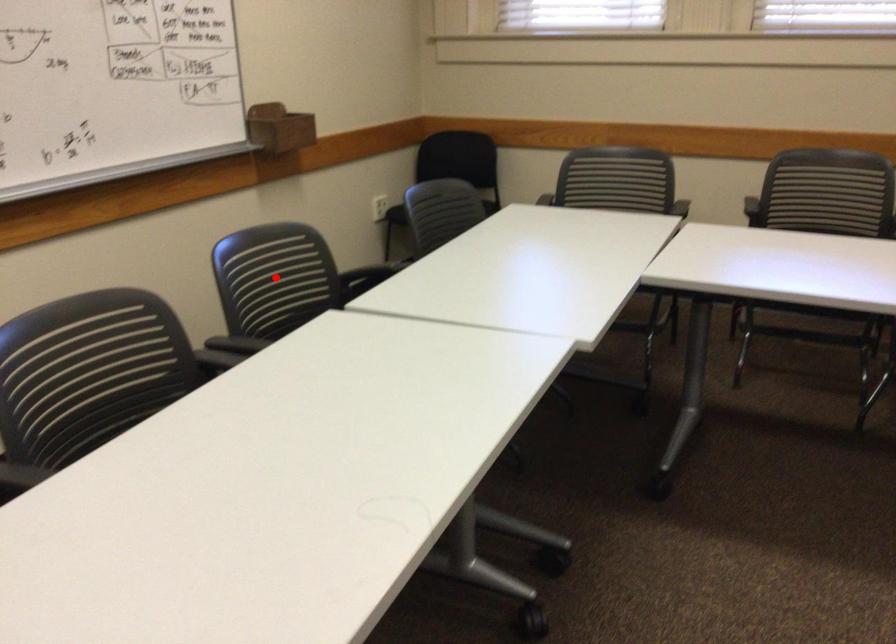
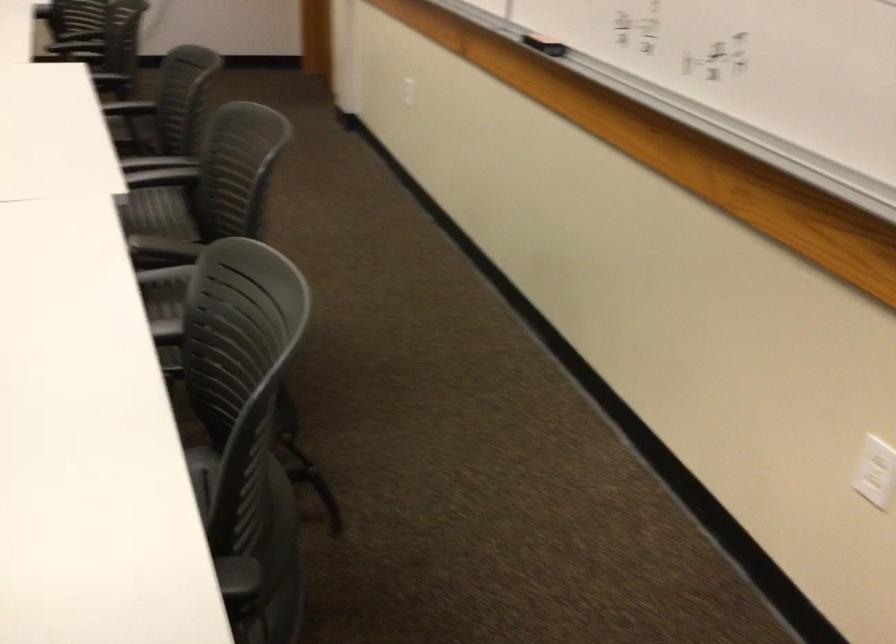
Question: I am providing you with two images of the same scene from different viewpoints. A red point is marked on the first image. Is the red point's position out of view in image 2?

Choices:
 (A) Yes
 (B) No

Answer: (A)